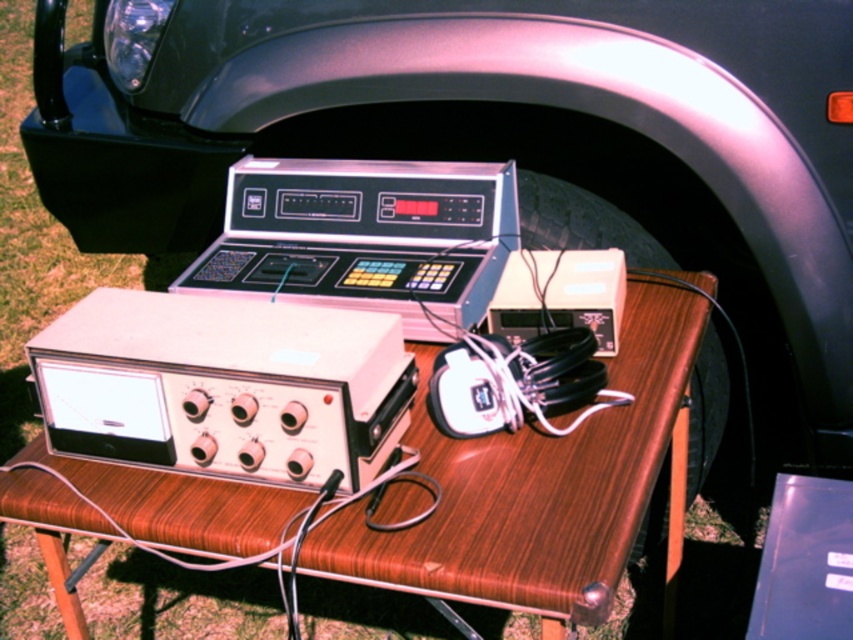
You are setting up an exhibit at a fair and need to place a metallic silver calculator at center on the wooden table at center. According to the scene description, where should you position the calculator relative to the table?

The wooden table at center is to the right of the metallic silver calculator at center, so you should place the calculator to the left side of the table.

You are setting up a science fair project and need to place a metallic silver calculator at center on the wooden table at center. The calculator requires a minimum of 12 inches of space between it and the edge of the table to function properly. Can you determine if there is enough space?

The wooden table at center and metallic silver calculator at center are 11.83 inches apart from each other, which is less than the required 12 inches. Therefore, there isn not enough space for the calculator to function properly.

You are standing in front of a vintage electronic setup displayed on a wooden table. There is a point marked at coordinates (543, 490). What object is located at this point?

The point at coordinates (543, 490) corresponds to the wooden table at center.